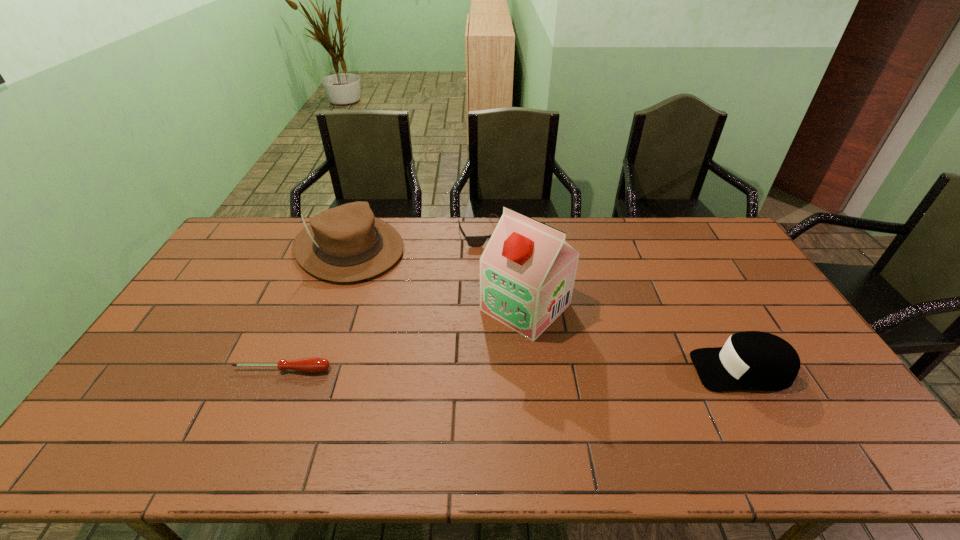
This screenshot has width=960, height=540. Find the location of `free space on the desktop that is between the shortest object and the third shortest object and is positioned with the cap open on the soya milk`. free space on the desktop that is between the shortest object and the third shortest object and is positioned with the cap open on the soya milk is located at coordinates (457, 370).

Identify the location of vacant space on the desktop that is between the screwdriver and the rightmost object and is positioned on the feather side of the fourth shortest object. This screenshot has height=540, width=960. (490, 370).

This screenshot has height=540, width=960. Identify the location of vacant space on the desktop that is between the shortest object and the cap and is positioned on the front-facing side of the fourth tallest object. (556, 370).